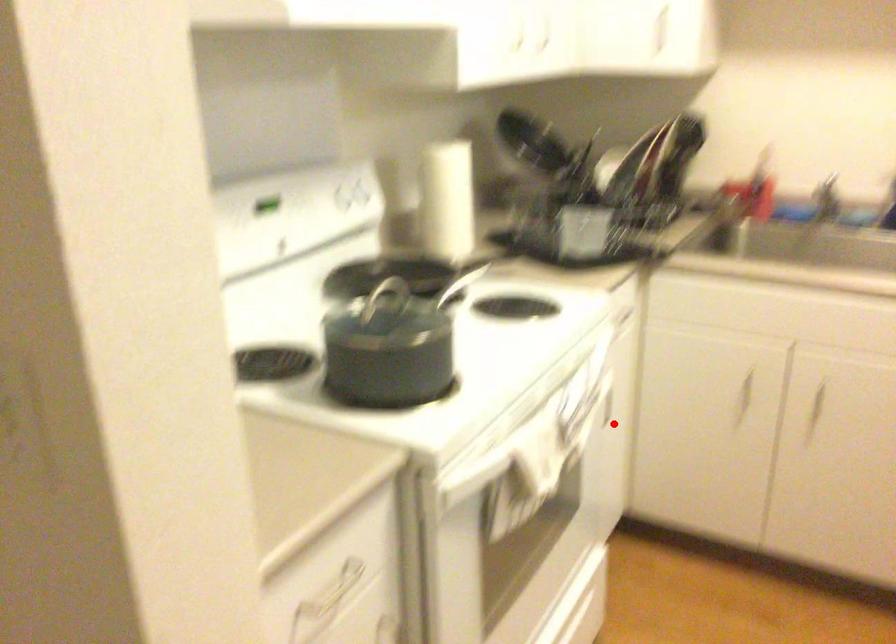
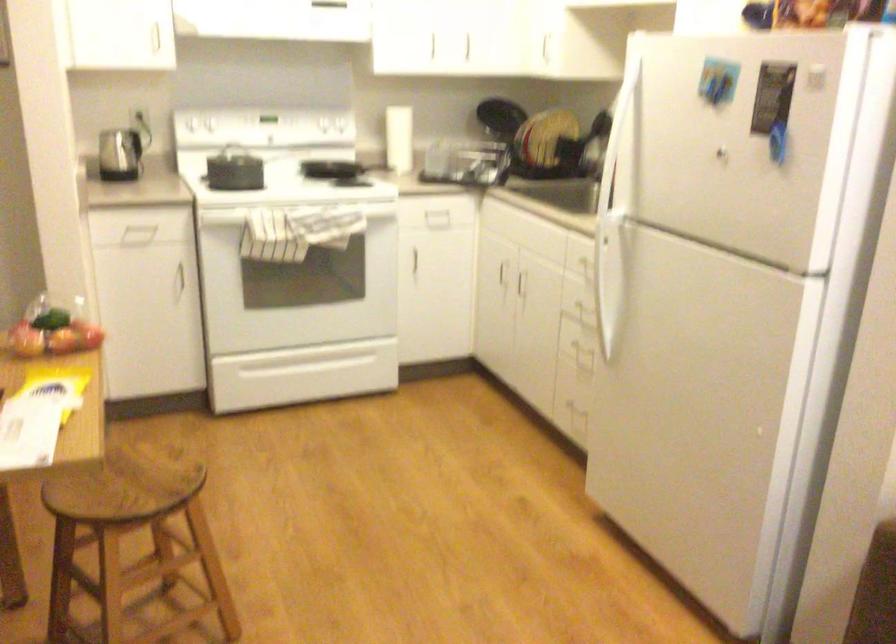
Question: I am providing you with two images of the same scene from different viewpoints. Image1 has a red point marked. In image2, the corresponding 3D location appears at what relative position? Reply with the corresponding letter.

Choices:
 (A) Closer
 (B) Farther

Answer: (B)